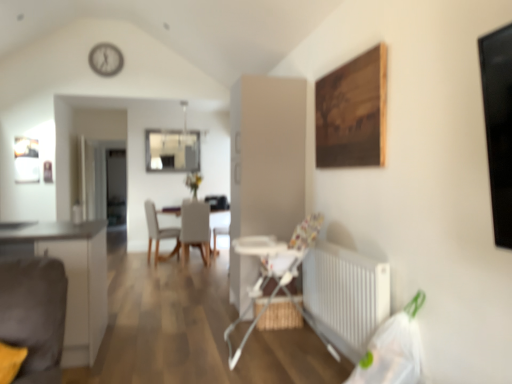
Question: Are white fabric chair at center, the 2th chair in the right-to-left sequence, and white plastic high chair at center beside each other?

Choices:
 (A) no
 (B) yes

Answer: (A)

Question: Does white fabric chair at center, arranged as the 1th chair when viewed from the left, have a lesser width compared to white plastic high chair at center?

Choices:
 (A) no
 (B) yes

Answer: (B)

Question: Could white plastic high chair at center be considered to be inside white fabric chair at center, the 2th chair in the right-to-left sequence?

Choices:
 (A) no
 (B) yes

Answer: (A)

Question: Is white fabric chair at center, the 2th chair in the right-to-left sequence, smaller than white plastic high chair at center?

Choices:
 (A) yes
 (B) no

Answer: (A)

Question: Is white fabric chair at center, arranged as the 1th chair when viewed from the left, positioned behind white plastic high chair at center?

Choices:
 (A) no
 (B) yes

Answer: (B)

Question: In terms of height, does white plastic high chair at center look taller or shorter compared to white plastic clock at upper center?

Choices:
 (A) short
 (B) tall

Answer: (B)

Question: From a real-world perspective, relative to white plastic clock at upper center, is white plastic high chair at center vertically above or below?

Choices:
 (A) above
 (B) below

Answer: (B)

Question: Based on their positions, is white plastic high chair at center located to the left or right of white plastic clock at upper center?

Choices:
 (A) left
 (B) right

Answer: (B)

Question: Considering the positions of white plastic high chair at center and white plastic clock at upper center in the image, is white plastic high chair at center bigger or smaller than white plastic clock at upper center?

Choices:
 (A) small
 (B) big

Answer: (B)

Question: Choose the correct answer: Is white plastic high chair at center inside wooden painting at upper right or outside it?

Choices:
 (A) inside
 (B) outside

Answer: (B)

Question: Considering the positions of white plastic high chair at center and wooden painting at upper right in the image, is white plastic high chair at center bigger or smaller than wooden painting at upper right?

Choices:
 (A) small
 (B) big

Answer: (B)

Question: Considering their positions, is white plastic high chair at center located in front of or behind wooden painting at upper right?

Choices:
 (A) behind
 (B) front

Answer: (A)

Question: From a real-world perspective, is white plastic high chair at center above or below wooden painting at upper right?

Choices:
 (A) above
 (B) below

Answer: (B)

Question: Considering the positions of point (197, 211) and point (368, 299), is point (197, 211) closer or farther from the camera than point (368, 299)?

Choices:
 (A) farther
 (B) closer

Answer: (A)

Question: Looking at their shapes, would you say matte gray chair at center, which ranks as the first chair in right-to-left order, is wider or thinner than white metallic radiator at lower right?

Choices:
 (A) wide
 (B) thin

Answer: (A)